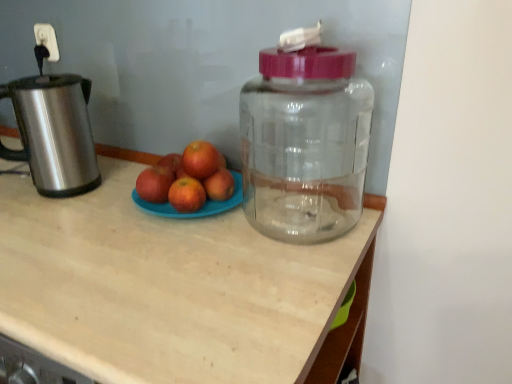
Question: Does point (209, 188) appear closer or farther from the camera than point (184, 155)?

Choices:
 (A) closer
 (B) farther

Answer: (A)

Question: Is red matte apple at center, which ranks as the 1th apple in right-to-left order, wider or thinner than red matte grapefruit at center, which appears as the 1th grapefruit when viewed from the top?

Choices:
 (A) thin
 (B) wide

Answer: (A)

Question: Estimate the real-world distances between objects in this image. Which object is farther from the red matte apple at center, acting as the second apple starting from the left?

Choices:
 (A) transparent plastic bottle at center
 (B) brushed metal kettle at left
 (C) red matte grapefruit at center, which appears as the 1th grapefruit when viewed from the top
 (D) red matte grapefruit at center, the first grapefruit when ordered from bottom to top
 (E) matte plastic plate of apples at center

Answer: (B)

Question: Considering the real-world distances, which object is farthest from the brushed metal kettle at left?

Choices:
 (A) red matte apple at center, which ranks as the second apple in right-to-left order
 (B) matte plastic plate of apples at center
 (C) red matte grapefruit at center, which is the second grapefruit from top to bottom
 (D) transparent plastic bottle at center
 (E) red matte grapefruit at center, which ranks as the second grapefruit in bottom-to-top order

Answer: (D)